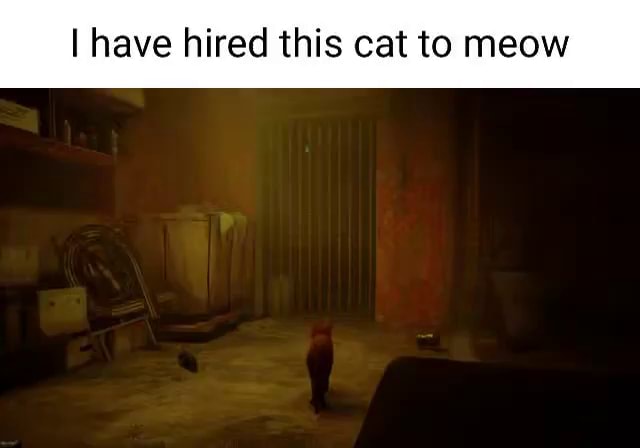
The height and width of the screenshot is (448, 640). In order to click on red wall in this screenshot , I will do `click(433, 257)`.